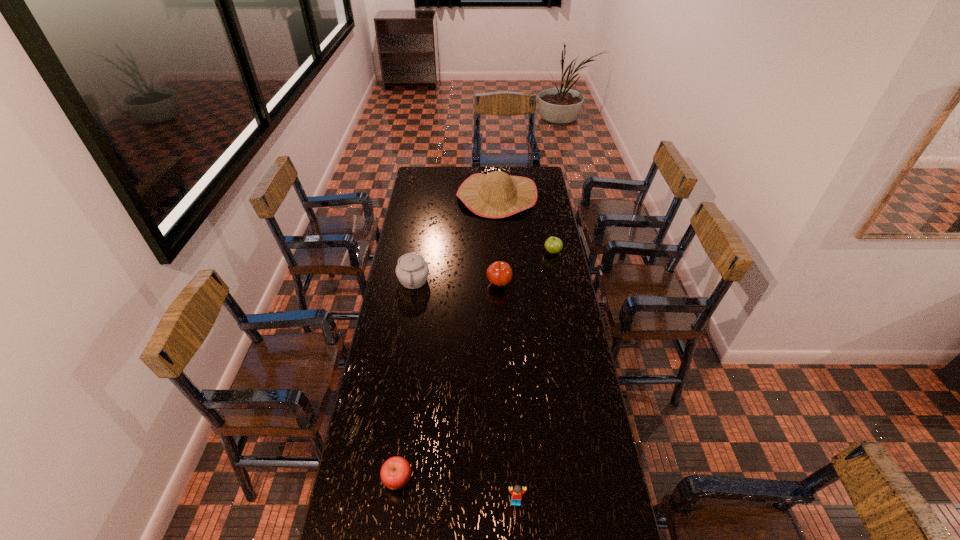
Identify the location of free location located 0.120m on the back of the chinaware. Image resolution: width=960 pixels, height=540 pixels. (419, 250).

Where is `vacant space situated on the right of the tallest apple`? The width and height of the screenshot is (960, 540). vacant space situated on the right of the tallest apple is located at coordinates (552, 284).

You are a GUI agent. You are given a task and a screenshot of the screen. Output one action in this format:
    pyautogui.click(x=<x>, y=<y>)
    Task: Click on the free spot located 0.290m on the back of the farthest apple
    
    Given the screenshot: What is the action you would take?
    pyautogui.click(x=545, y=213)

The image size is (960, 540). What are the coordinates of `free point located 0.070m on the face of the Lego` in the screenshot? It's located at (517, 532).

Find the location of `vacant region located on the front of the leftmost apple`. vacant region located on the front of the leftmost apple is located at coordinates click(x=390, y=535).

You are a GUI agent. You are given a task and a screenshot of the screen. Output one action in this format:
    pyautogui.click(x=<x>, y=<y>)
    Task: Click on the object present at the far edge
    The height and width of the screenshot is (540, 960).
    Given the screenshot: What is the action you would take?
    pyautogui.click(x=494, y=195)

Where is `chinaware located in the left edge section of the desktop`? The image size is (960, 540). chinaware located in the left edge section of the desktop is located at coordinates (412, 271).

Where is `apple that is at the left edge`? This screenshot has width=960, height=540. apple that is at the left edge is located at coordinates (395, 473).

Find the location of `sunhat positioned at the right edge`. sunhat positioned at the right edge is located at coordinates (494, 195).

Locate an element on the screen. This screenshot has width=960, height=540. apple located in the right edge section of the desktop is located at coordinates (553, 245).